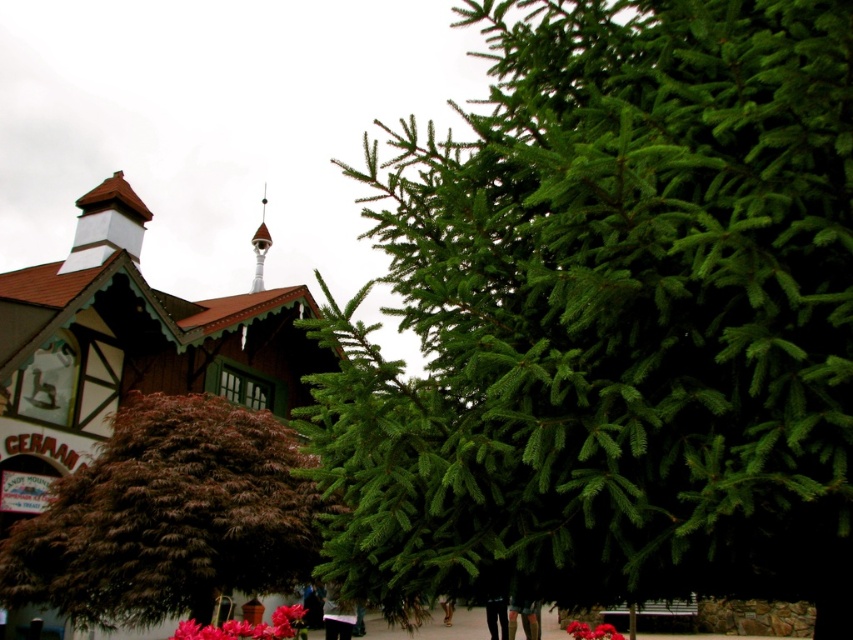
You are a photographer planning to capture the white wood spire at upper center and the vivid pink petals at center in the same frame. Based on their heights, which object will appear taller in the photo?

The white wood spire at upper center will appear taller in the photo because it has a greater height compared to the vivid pink petals at center.